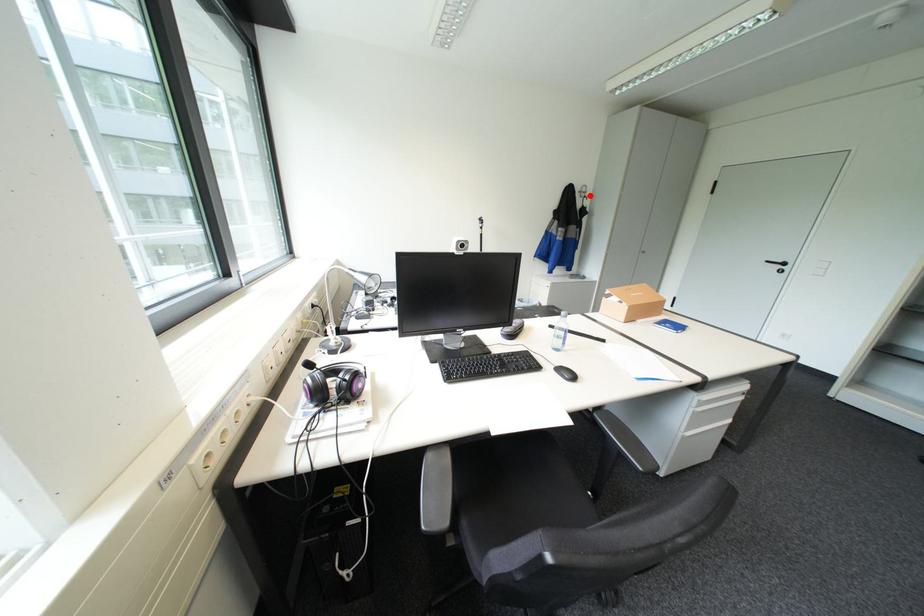
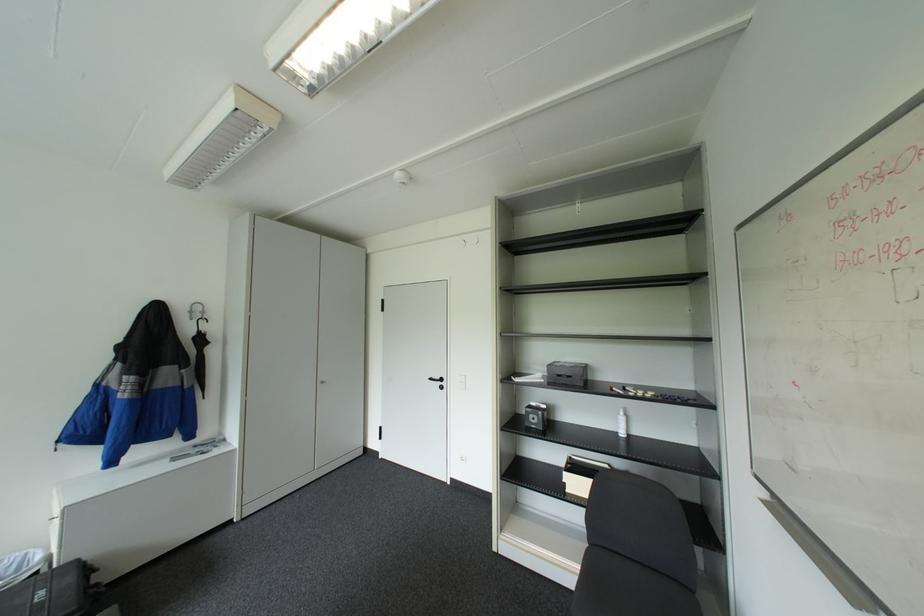
Question: I am providing you with two images of the same scene from different viewpoints. Given a red point in image1, look at the same physical point in image2. Is it:

Choices:
 (A) Closer to the viewpoint
 (B) Farther from the viewpoint

Answer: (B)